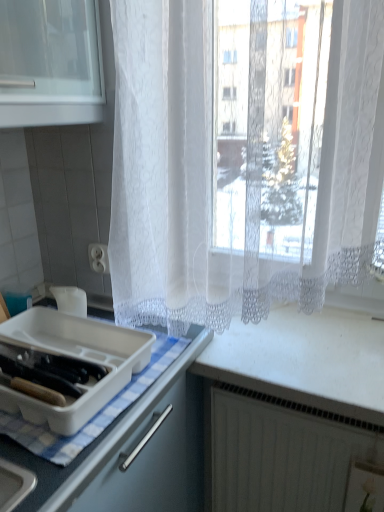
I want to click on white plastic tray at lower left, so click(x=76, y=359).

Describe the element at coordinates (76, 359) in the screenshot. This screenshot has height=512, width=384. I see `white plastic tray at lower left` at that location.

What is the approximate width of white plastic tray at lower left?

16.30 inches.

At what (x,y) coordinates should I click in order to perform the action: click on white plastic tray at lower left. Please return your answer as a coordinate pair (x, y). This screenshot has height=512, width=384. Looking at the image, I should click on (76, 359).